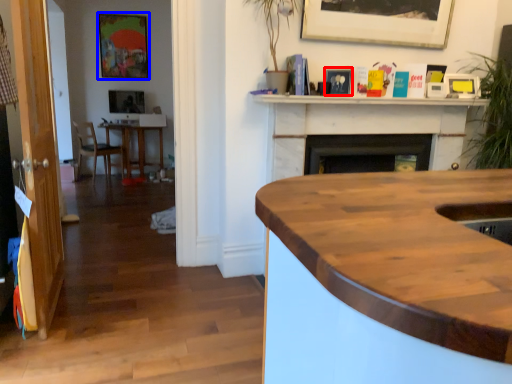
Question: Among these objects, which one is nearest to the camera, picture frame (highlighted by a red box) or picture frame (highlighted by a blue box)?

Choices:
 (A) picture frame
 (B) picture frame

Answer: (A)